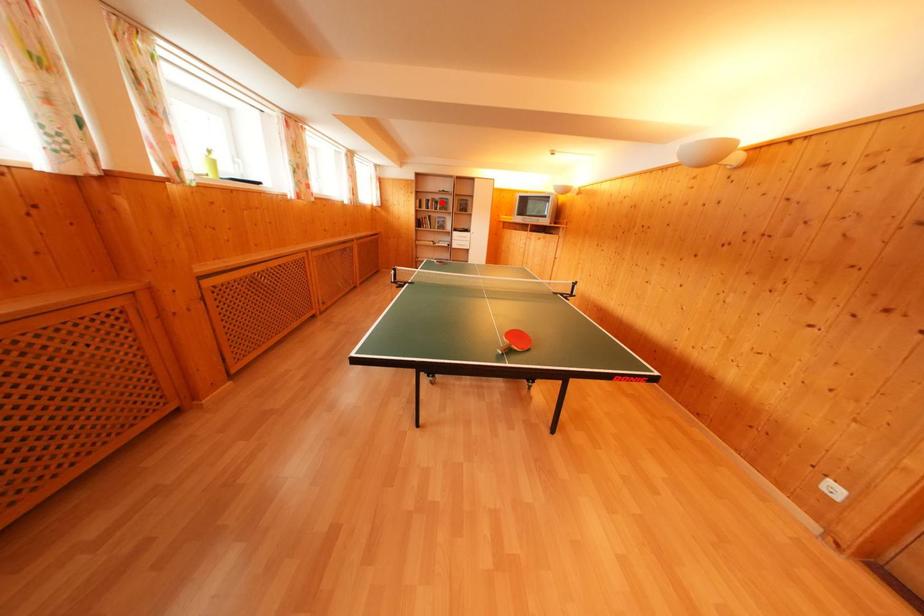
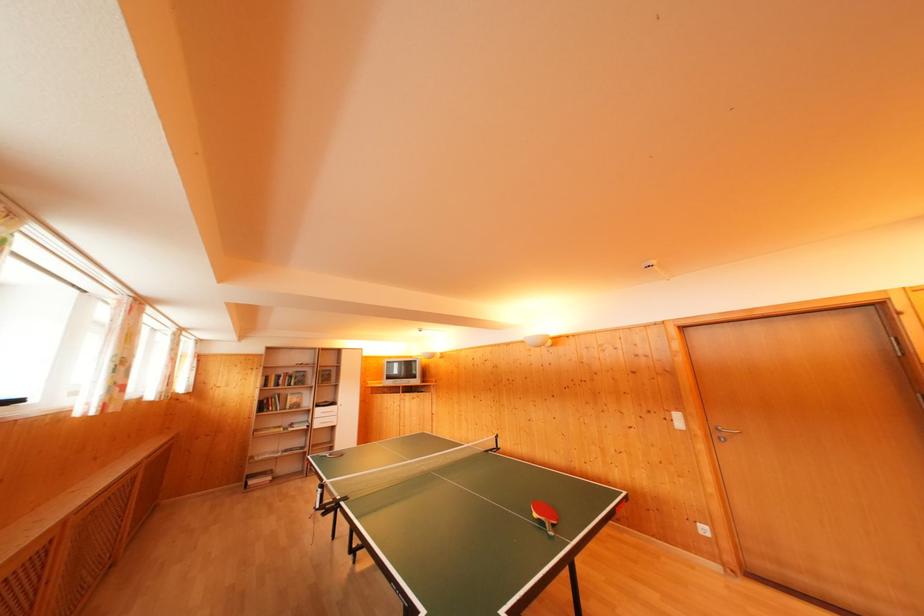
The point at the highlighted location is marked in the first image. Where is the corresponding point in the second image?

(296, 376)